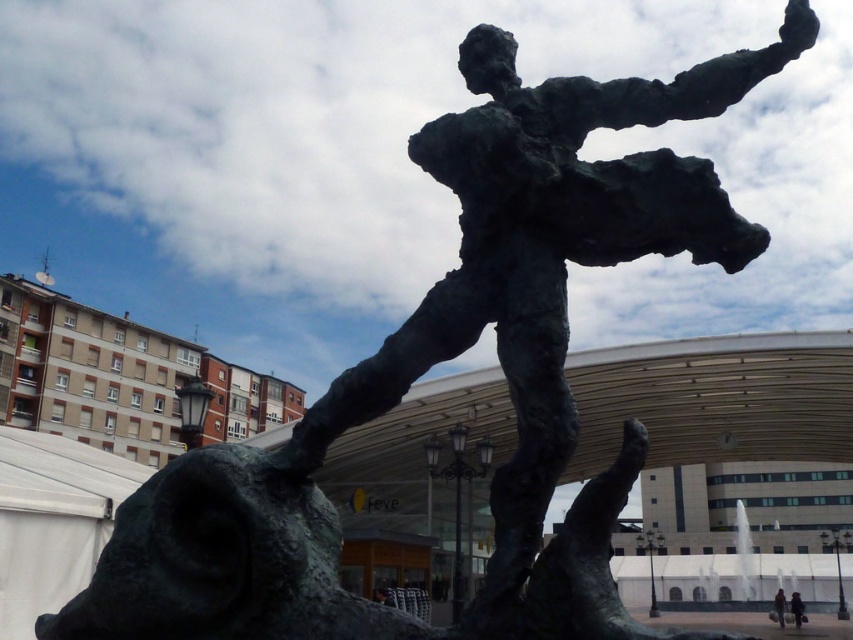
You are standing at the center of the image and want to find the dark brown leather jacket at lower right. In which direction should you look to locate it?

You should look to the lower right direction to locate the dark brown leather jacket at lower right since its 2D location is at point (798,609).

You are an art installer setting up a display. You have a dark brown leather jacket at lower right and a dark gray fabric bag at lower right. Which object is shorter?

The dark brown leather jacket at lower right is shorter than the dark gray fabric bag at lower right.